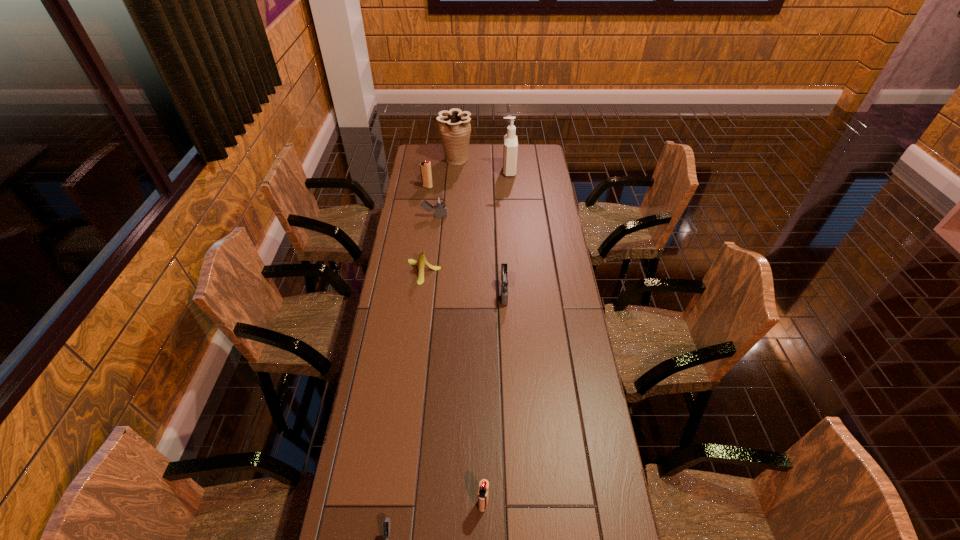
You are a GUI agent. You are given a task and a screenshot of the screen. Output one action in this format:
    pyautogui.click(x=<x>, y=<y>)
    Task: Click on the cleansing agent that is positioned at the far edge
    
    Given the screenshot: What is the action you would take?
    tap(510, 148)

I want to click on urn at the far edge, so 454,125.

The width and height of the screenshot is (960, 540). Identify the location of urn situated at the left edge. (454, 125).

You are a GUI agent. You are given a task and a screenshot of the screen. Output one action in this format:
    pyautogui.click(x=<x>, y=<y>)
    Task: Click on the banana situated at the left edge
    The width and height of the screenshot is (960, 540).
    Given the screenshot: What is the action you would take?
    pyautogui.click(x=422, y=261)

Identify the location of object present at the far left corner. (454, 125).

The image size is (960, 540). Identify the location of vacant space at the left edge of the desktop. (411, 264).

The height and width of the screenshot is (540, 960). In the image, there is a desktop. Find the location of `vacant area at the right edge`. vacant area at the right edge is located at coordinates (528, 184).

Where is `blank space at the far left corner of the desktop`? The image size is (960, 540). blank space at the far left corner of the desktop is located at coordinates (418, 147).

This screenshot has height=540, width=960. I want to click on free space that is in between the farthest igniter and the nearer red igniter, so click(x=455, y=345).

At what (x,y) coordinates should I click in order to perform the action: click on free spot between the rightmost igniter and the cleansing agent. Please return your answer as a coordinate pair (x, y). The width and height of the screenshot is (960, 540). Looking at the image, I should click on (506, 232).